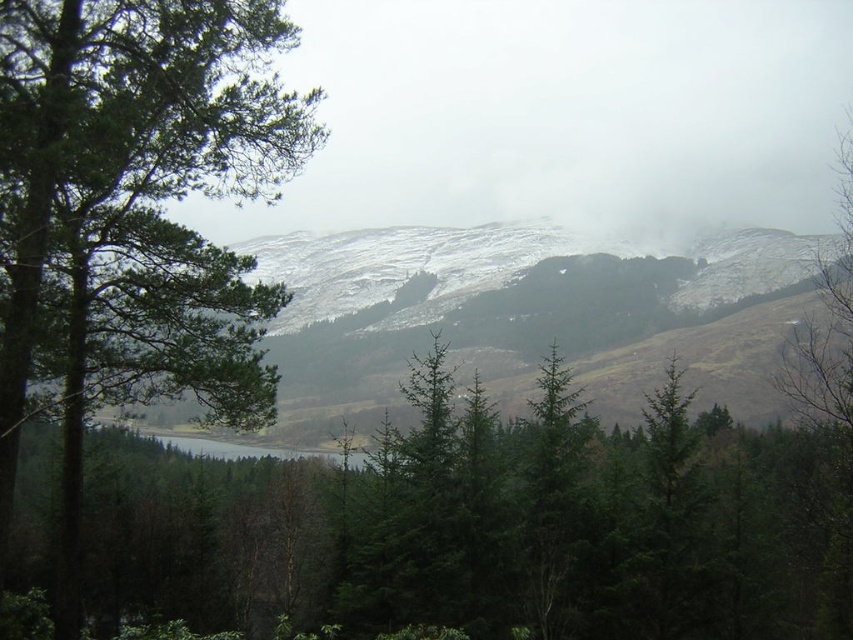
Does green matte forest at center have a greater height compared to green matte tree at left?

No, green matte forest at center is not taller than green matte tree at left.

Is green matte forest at center below green matte tree at left?

Yes, green matte forest at center is below green matte tree at left.

Does point (483, 417) come behind point (132, 173)?

Yes, point (483, 417) is behind point (132, 173).

At what (x,y) coordinates should I click in order to perform the action: click on green matte forest at center. Please return your answer as a coordinate pair (x, y). Looking at the image, I should click on (486, 528).